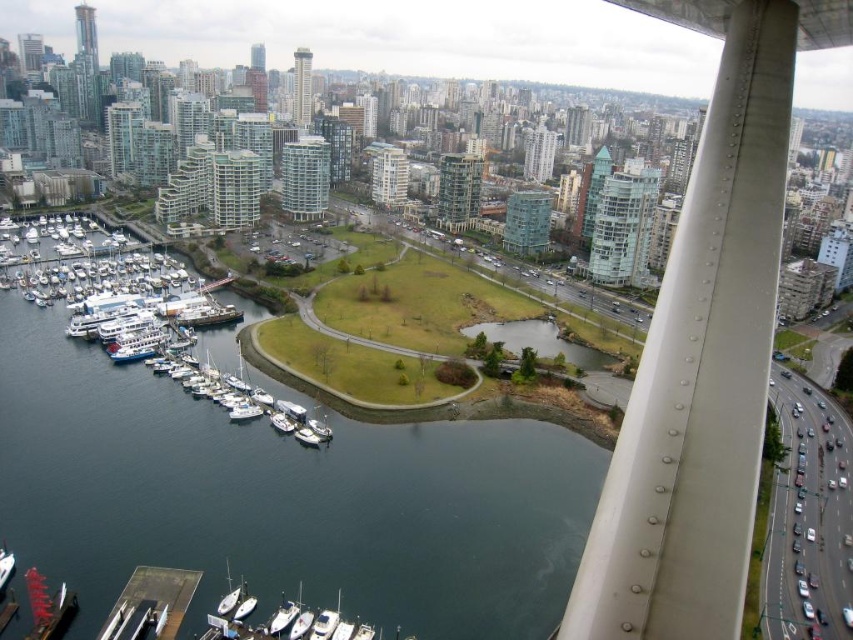
Question: Which point appears farthest from the camera in this image?

Choices:
 (A) (471, 461)
 (B) (282, 416)
 (C) (114, 349)

Answer: (C)

Question: Estimate the real-world distances between objects in this image. Which object is closer to the white matte sailboat at lower center?

Choices:
 (A) metallic gray dock at lower left
 (B) dark blue water at center
 (C) white matte boat at lower center

Answer: (C)

Question: Is white matte boats at lower left closer to the viewer compared to white matte sailboat at lower center?

Choices:
 (A) yes
 (B) no

Answer: (A)

Question: Does dark blue water at center have a larger size compared to white matte sailboat at lower center?

Choices:
 (A) no
 (B) yes

Answer: (B)

Question: Does white matte boats at lower left have a lesser width compared to white matte sailboat at lower center?

Choices:
 (A) yes
 (B) no

Answer: (B)

Question: Which is farther from the dark blue water at center?

Choices:
 (A) white matte boat at lower center
 (B) white matte boats at lower left
 (C) metallic gray dock at lower left

Answer: (A)